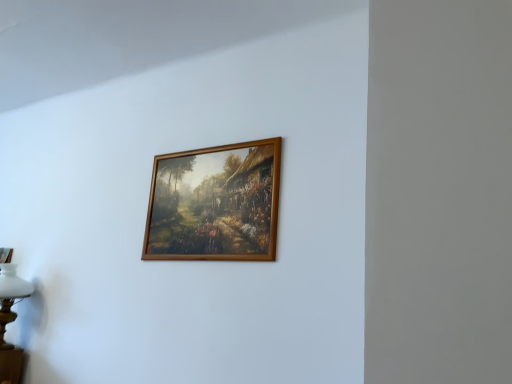
Question: Is wooden frame at center in front of or behind white glass table lamp at lower left in the image?

Choices:
 (A) front
 (B) behind

Answer: (A)

Question: Is point (159, 165) positioned closer to the camera than point (20, 291)?

Choices:
 (A) farther
 (B) closer

Answer: (B)

Question: In terms of height, does wooden frame at center look taller or shorter compared to white glass table lamp at lower left?

Choices:
 (A) short
 (B) tall

Answer: (B)

Question: Does point (28, 289) appear closer or farther from the camera than point (266, 236)?

Choices:
 (A) farther
 (B) closer

Answer: (A)

Question: In terms of height, does white glass table lamp at lower left look taller or shorter compared to wooden frame at center?

Choices:
 (A) tall
 (B) short

Answer: (B)

Question: From the image's perspective, is white glass table lamp at lower left above or below wooden frame at center?

Choices:
 (A) above
 (B) below

Answer: (B)

Question: Is white glass table lamp at lower left in front of or behind wooden frame at center in the image?

Choices:
 (A) behind
 (B) front

Answer: (A)